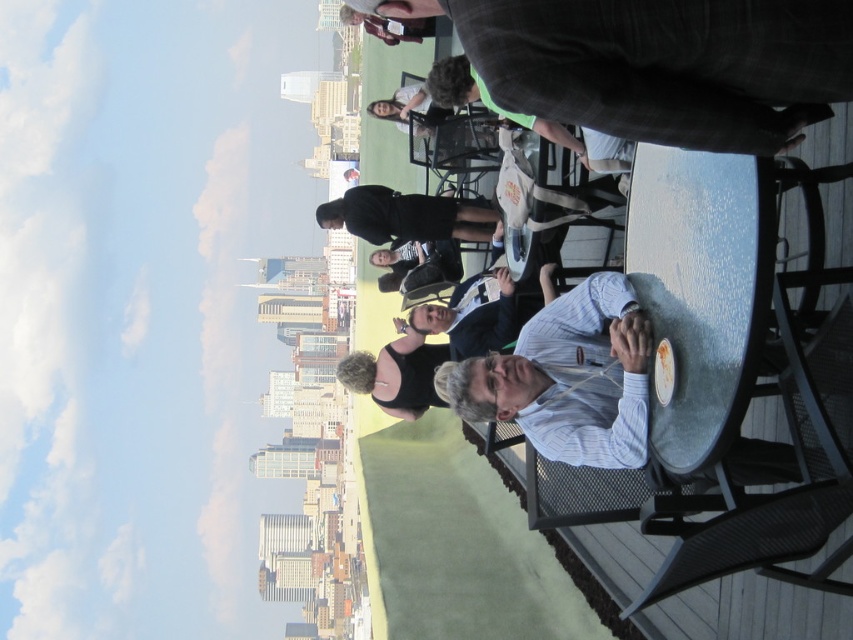
You are at a rooftop event and notice two people sitting at the same table. One is wearing a black matte shirt at center and the other a striped shirt at center. Which person is sitting closer to the edge of the table?

The black matte shirt at center is above the striped shirt at center, so the person wearing the black matte shirt at center is sitting closer to the edge of the table.

You are a photographer at the event and want to capture both the black matte shirt at center and the striped shirt at center in a single photo. Since the camera has a limited focus range, which shirt should you focus on to ensure both are in focus?

The black matte shirt at center is bigger than the striped shirt at center, so focusing on the black matte shirt at center will ensure both are in focus because it is larger and closer to the camera.